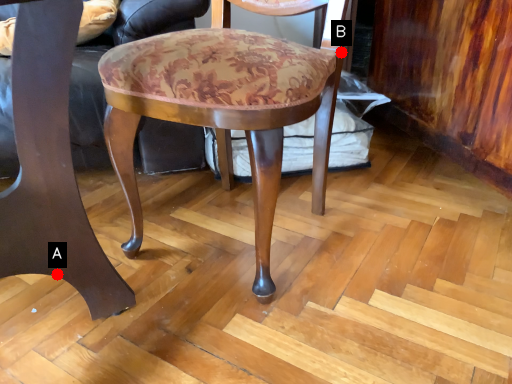
Question: Two points are circled on the image, labeled by A and B beside each circle. Which point appears farthest from the camera in this image?

Choices:
 (A) A is further
 (B) B is further

Answer: (B)